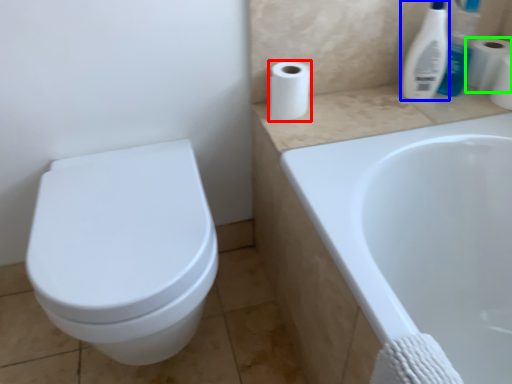
Question: Which is farther away from toilet paper (highlighted by a red box)? cleaning product (highlighted by a blue box) or toilet paper (highlighted by a green box)?

Choices:
 (A) cleaning product
 (B) toilet paper

Answer: (B)